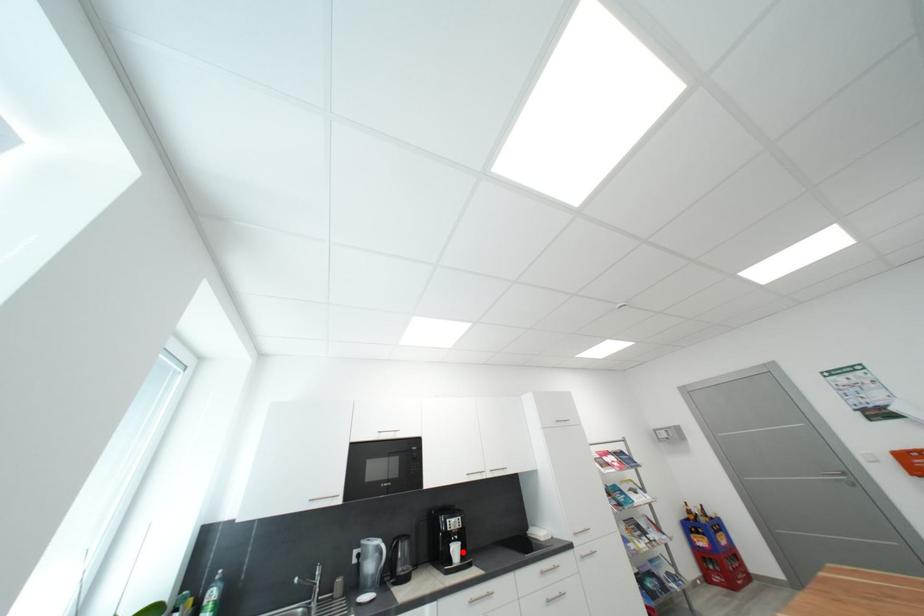
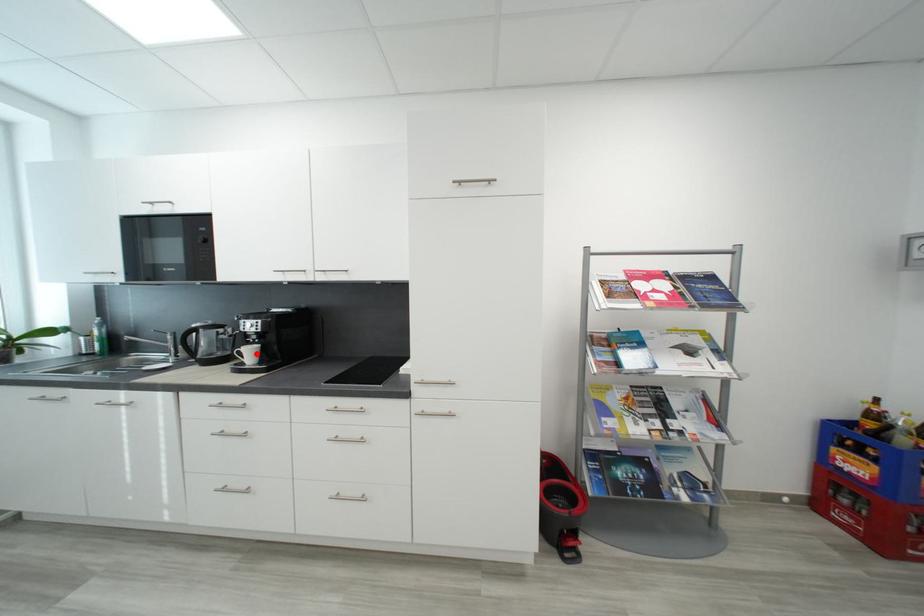
I am providing you with two images of the same scene from different viewpoints. A red point is marked on the first image and another point is marked on the second image. Is the marked point in image1 the same physical position as the marked point in image2?

Yes